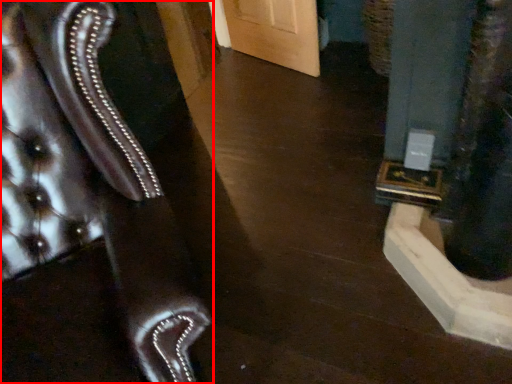
Question: From the image's perspective, where is furniture (annotated by the red box) located relative to pillar?

Choices:
 (A) below
 (B) above

Answer: (A)